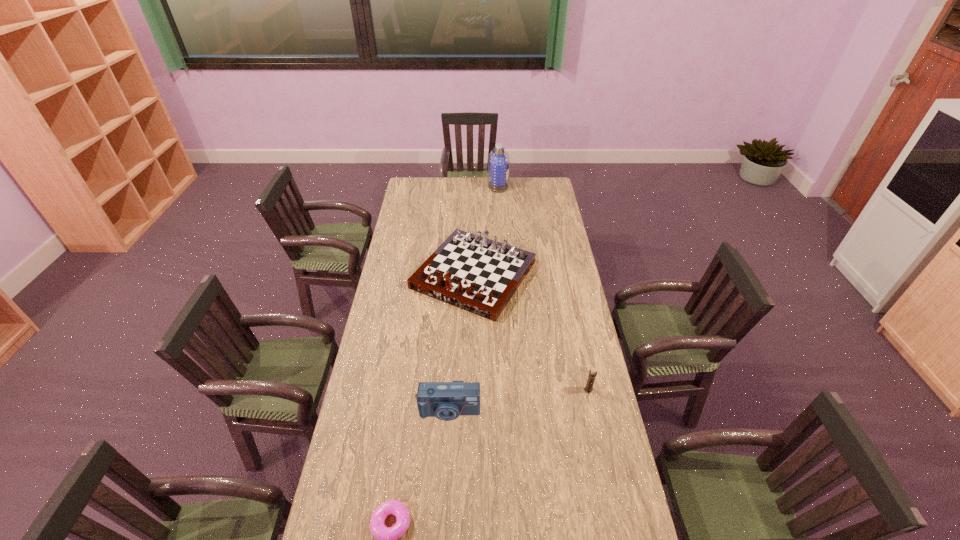
I want to click on object present at the far edge, so click(498, 160).

Where is `object that is positioned at the left edge`? object that is positioned at the left edge is located at coordinates (474, 273).

You are a GUI agent. You are given a task and a screenshot of the screen. Output one action in this format:
    pyautogui.click(x=<x>, y=<y>)
    Task: Click on the object that is at the right edge
    
    Given the screenshot: What is the action you would take?
    pyautogui.click(x=592, y=374)

In the image, there is a desktop. At what (x,y) coordinates should I click in order to perform the action: click on vacant space at the left edge. Please return your answer as a coordinate pair (x, y). This screenshot has height=540, width=960. Looking at the image, I should click on (403, 226).

The width and height of the screenshot is (960, 540). Find the location of `vacant space at the right edge`. vacant space at the right edge is located at coordinates (578, 342).

The width and height of the screenshot is (960, 540). I want to click on vacant space at the far left corner of the desktop, so click(413, 181).

This screenshot has height=540, width=960. Identify the location of vacant space at the far right corner of the desktop. (540, 185).

Locate an element on the screen. Image resolution: width=960 pixels, height=540 pixels. empty space that is in between the second farthest object and the camera is located at coordinates (462, 343).

The image size is (960, 540). Identify the location of unoccupied area between the cleansing agent and the candle holder. (543, 288).

Find the location of a particular element. This screenshot has width=960, height=540. vacant point located between the camera and the fourth nearest object is located at coordinates (462, 343).